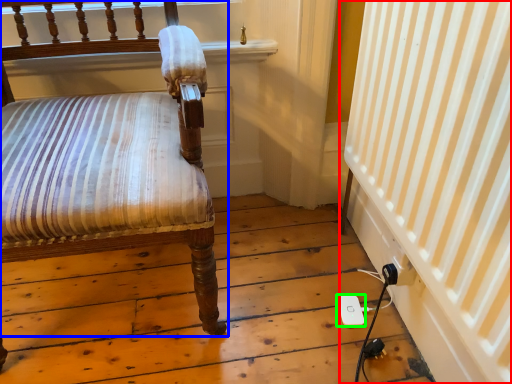
Question: Which is nearer to the curtain (highlighted by a red box)? chair (highlighted by a blue box) or ipod (highlighted by a green box).

Choices:
 (A) chair
 (B) ipod

Answer: (B)